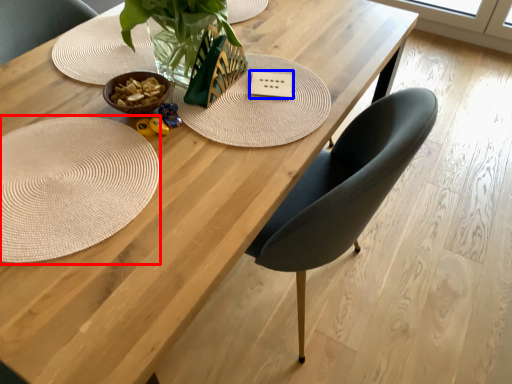
Question: Which object is further to the camera taking this photo, mat (highlighted by a red box) or card (highlighted by a blue box)?

Choices:
 (A) mat
 (B) card

Answer: (B)